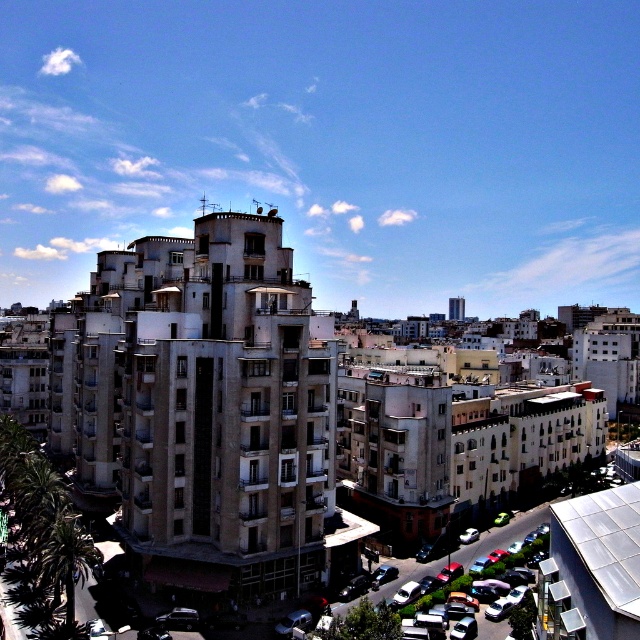
Does shiny black car at center appear on the left side of white glossy car at center?

Indeed, shiny black car at center is positioned on the left side of white glossy car at center.

Is point (161, 625) positioned behind point (470, 528)?

No, (161, 625) is in front of (470, 528).

Identify the location of shiny black car at center. (179, 618).

Does shiny silver car at lower right have a lesser height compared to shiny black car at center?

Incorrect, shiny silver car at lower right's height does not fall short of shiny black car at center's.

Between point (520, 516) and point (180, 614), which one is positioned behind?

The point (520, 516) is more distant.

Which is in front, point (496, 531) or point (172, 611)?

Positioned in front is point (172, 611).

Locate an element on the screen. shiny silver car at lower right is located at coordinates (481, 554).

Does shiny silver car at lower right have a greater width compared to white glossy car at center?

Indeed, shiny silver car at lower right has a greater width compared to white glossy car at center.

In the scene shown: Can you confirm if shiny silver car at lower right is positioned to the right of white glossy car at center?

Indeed, shiny silver car at lower right is positioned on the right side of white glossy car at center.

The image size is (640, 640). What do you see at coordinates (481, 554) in the screenshot? I see `shiny silver car at lower right` at bounding box center [481, 554].

Locate an element on the screen. The image size is (640, 640). shiny silver car at lower right is located at coordinates [x=481, y=554].